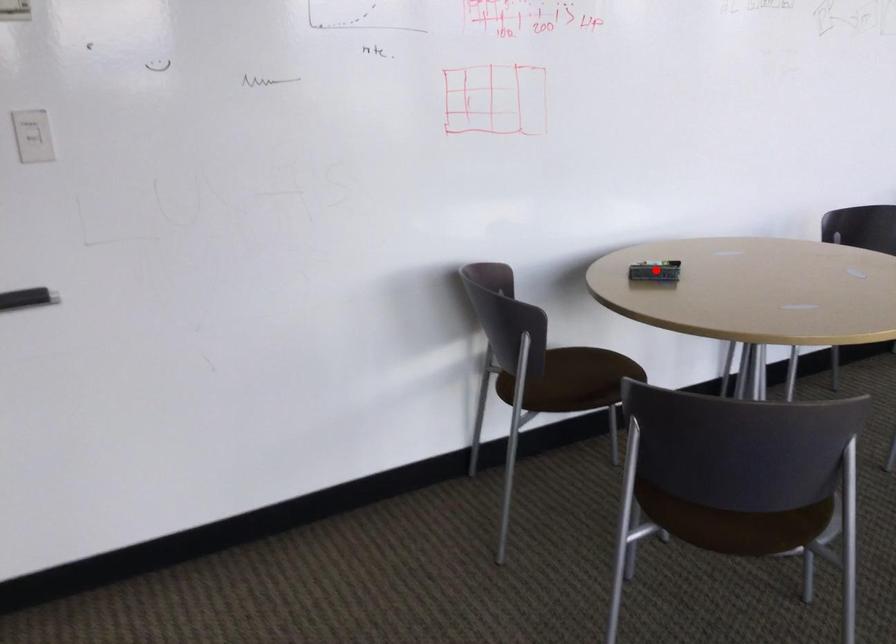
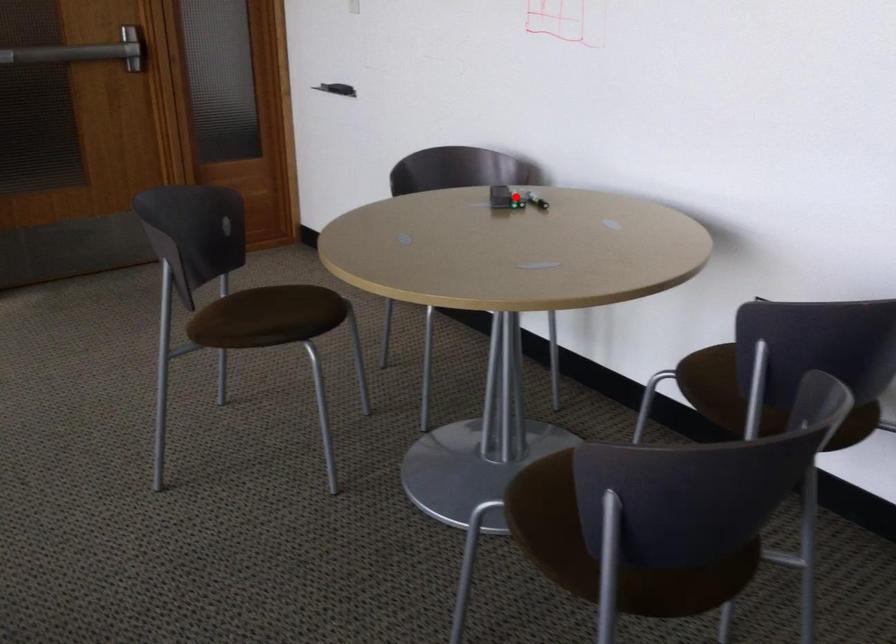
I am providing you with two images of the same scene from different viewpoints. A red point is marked on the first image and another point is marked on the second image. Is the red point in image1 aligned with the point shown in image2?

Yes